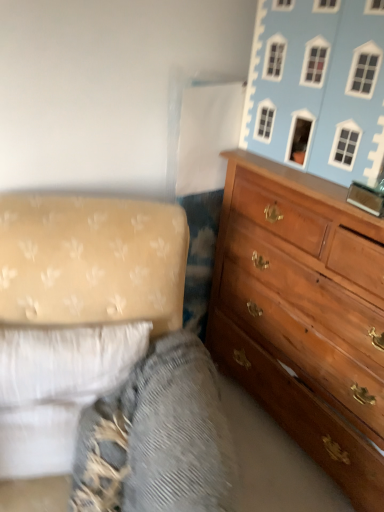
Question: Can you confirm if light blue painted wood dollhouse at upper right is wider than wooden dresser at right?

Choices:
 (A) yes
 (B) no

Answer: (B)

Question: From a real-world perspective, is light blue painted wood dollhouse at upper right positioned under wooden dresser at right based on gravity?

Choices:
 (A) no
 (B) yes

Answer: (A)

Question: Does light blue painted wood dollhouse at upper right appear on the right side of wooden dresser at right?

Choices:
 (A) no
 (B) yes

Answer: (A)

Question: Is light blue painted wood dollhouse at upper right next to wooden dresser at right?

Choices:
 (A) yes
 (B) no

Answer: (B)

Question: Is light blue painted wood dollhouse at upper right further to camera compared to wooden dresser at right?

Choices:
 (A) no
 (B) yes

Answer: (B)

Question: Does light blue painted wood dollhouse at upper right come in front of wooden dresser at right?

Choices:
 (A) no
 (B) yes

Answer: (A)

Question: From the image's perspective, is wooden dresser at right over textured fabric at lower left?

Choices:
 (A) yes
 (B) no

Answer: (A)

Question: Is wooden dresser at right thinner than textured fabric at lower left?

Choices:
 (A) no
 (B) yes

Answer: (B)

Question: Is wooden dresser at right not inside textured fabric at lower left?

Choices:
 (A) no
 (B) yes

Answer: (B)

Question: Considering the relative positions of wooden dresser at right and textured fabric at lower left in the image provided, is wooden dresser at right behind textured fabric at lower left?

Choices:
 (A) yes
 (B) no

Answer: (A)

Question: From a real-world perspective, is wooden dresser at right below textured fabric at lower left?

Choices:
 (A) no
 (B) yes

Answer: (A)

Question: Is wooden dresser at right shorter than textured fabric at lower left?

Choices:
 (A) yes
 (B) no

Answer: (B)

Question: Can you confirm if wooden dresser at right is thinner than light blue painted wood dollhouse at upper right?

Choices:
 (A) yes
 (B) no

Answer: (B)